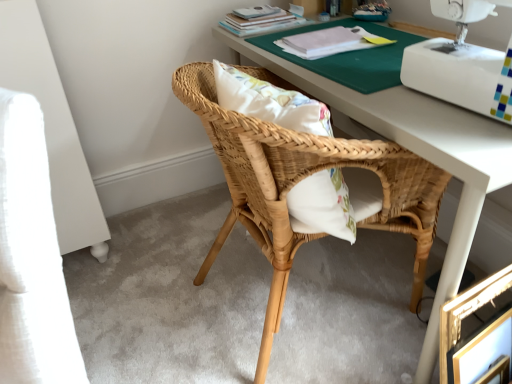
Question: Looking at the image, does matte paper book at upper center, the 2th book in the front-to-back sequence, seem bigger or smaller compared to gold metallic picture frame at lower right?

Choices:
 (A) small
 (B) big

Answer: (A)

Question: From the image's perspective, is matte paper book at upper center, the 2th book in the front-to-back sequence, above or below gold metallic picture frame at lower right?

Choices:
 (A) below
 (B) above

Answer: (B)

Question: Estimate the real-world distances between objects in this image. Which object is closer to the natural wood chair at center?

Choices:
 (A) matte paper book at upper center, placed as the 1th book when sorted from back to front
 (B) gold metallic picture frame at lower right
 (C) white paper at upper center, the first book when ordered from front to back
 (D) white plastic sewing machine at upper right

Answer: (D)

Question: Which object is positioned farthest from the matte paper book at upper center, placed as the 1th book when sorted from back to front?

Choices:
 (A) gold metallic picture frame at lower right
 (B) white plastic sewing machine at upper right
 (C) white paper at upper center, the first book when ordered from front to back
 (D) natural wood chair at center

Answer: (A)